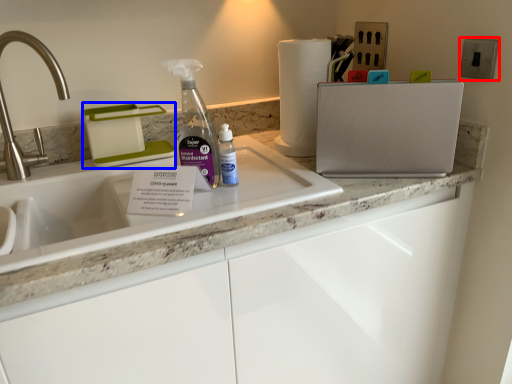
Question: Which object is further to the camera taking this photo, electric outlet (highlighted by a red box) or appliance (highlighted by a blue box)?

Choices:
 (A) electric outlet
 (B) appliance

Answer: (B)